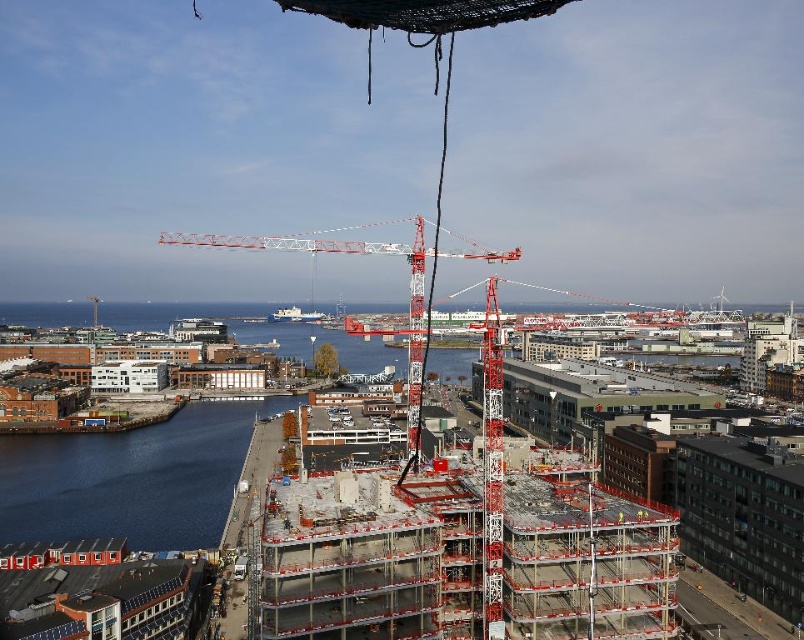
Who is lower down, concrete building at center or red metal crane at center?

concrete building at center

Who is shorter, concrete building at center or red metal crane at center?

concrete building at center

Identify the location of concrete building at center. (130, 477).

Locate an element on the screen. The width and height of the screenshot is (804, 640). concrete building at center is located at coordinates (130, 477).

Can you confirm if concrete building at center is thinner than blue water at lower left?

No.

Is point (154, 534) positioned before point (117, 534)?

Yes, it is in front of point (117, 534).

Identify the location of concrete building at center. This screenshot has height=640, width=804. (130, 477).

Does blue water at lower left have a lesser height compared to red metal crane at center?

Yes.

Who is positioned more to the right, blue water at lower left or red metal crane at center?

From the viewer's perspective, red metal crane at center appears more on the right side.

The height and width of the screenshot is (640, 804). What do you see at coordinates (130, 477) in the screenshot?
I see `blue water at lower left` at bounding box center [130, 477].

Identify the location of blue water at lower left. (130, 477).